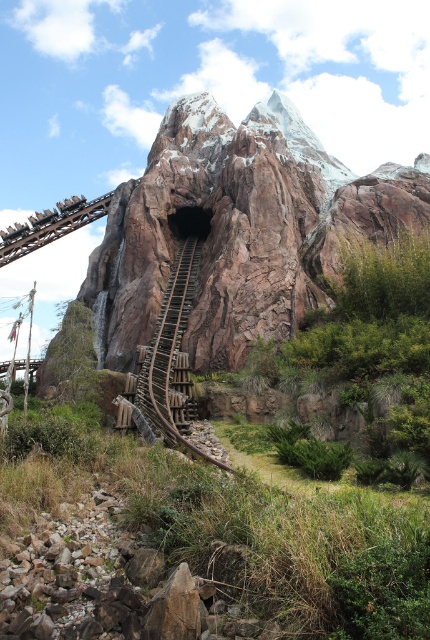
Does rustic wood mountain at center lie in front of wooden at center?

No, rustic wood mountain at center is behind wooden at center.

Where is `rustic wood mountain at center`? The image size is (430, 640). rustic wood mountain at center is located at coordinates (237, 228).